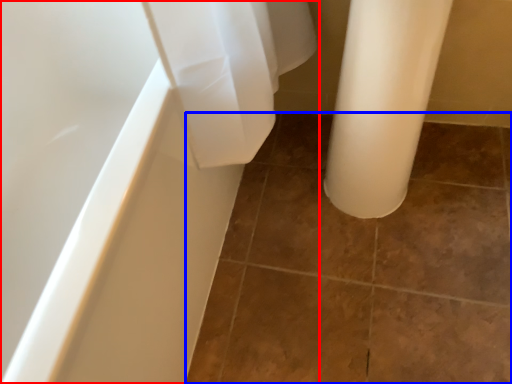
Question: Among these objects, which one is nearest to the camera, bathtub (highlighted by a red box) or ceramic tile (highlighted by a blue box)?

Choices:
 (A) bathtub
 (B) ceramic tile

Answer: (A)